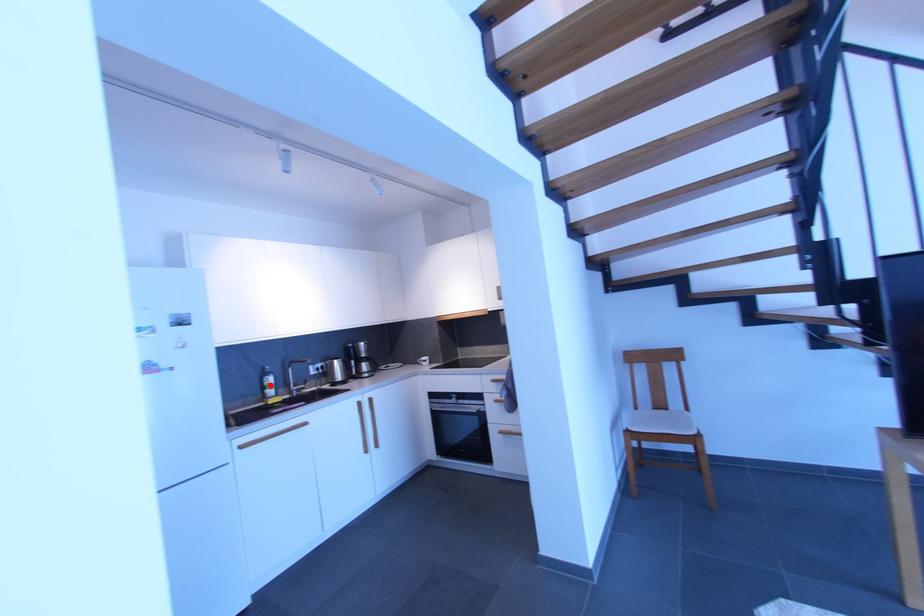
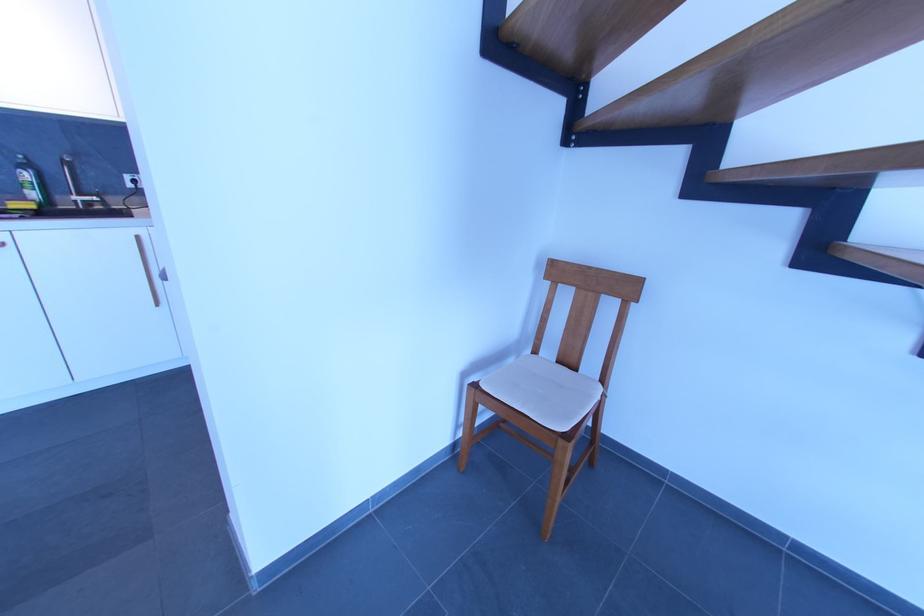
Question: I am providing you with two images of the same scene from different viewpoints. A red point is shown in image1. For the corresponding object point in image2, is it positioned nearer or farther from the camera?

Choices:
 (A) Nearer
 (B) Farther

Answer: (B)